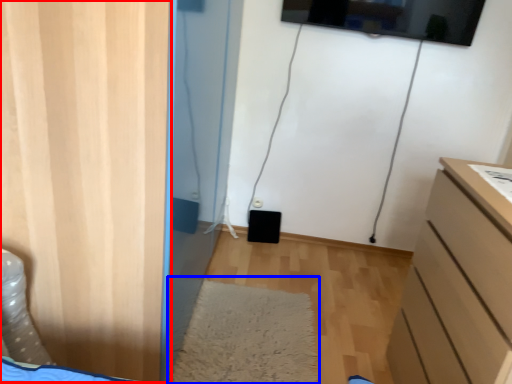
Question: Which of the following is the farthest to the observer, door (highlighted by a red box) or mat (highlighted by a blue box)?

Choices:
 (A) door
 (B) mat

Answer: (B)